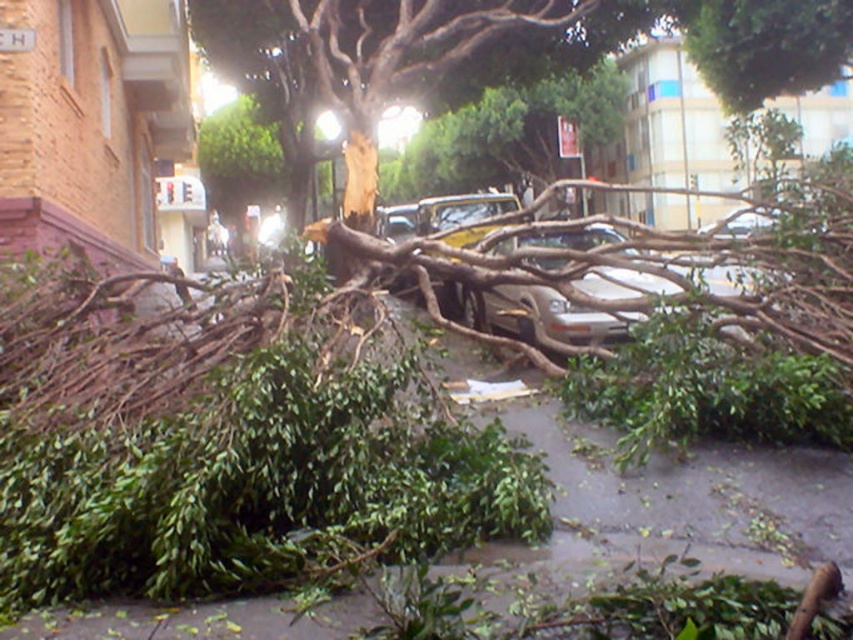
Question: Is green leafy debris at center to the right of brown rough bark tree at center from the viewer's perspective?

Choices:
 (A) no
 (B) yes

Answer: (A)

Question: Among these points, which one is nearest to the camera?

Choices:
 (A) (476, 458)
 (B) (384, 84)

Answer: (A)

Question: Which point appears closest to the camera in this image?

Choices:
 (A) (848, 38)
 (B) (450, 458)

Answer: (B)

Question: Which point is closer to the camera?

Choices:
 (A) green leafy debris at center
 (B) brown rough bark tree at center

Answer: (A)

Question: Does green leafy debris at center have a smaller size compared to brown rough bark tree at center?

Choices:
 (A) no
 (B) yes

Answer: (B)

Question: Does green leafy debris at center appear on the right side of brown rough bark tree at center?

Choices:
 (A) no
 (B) yes

Answer: (A)